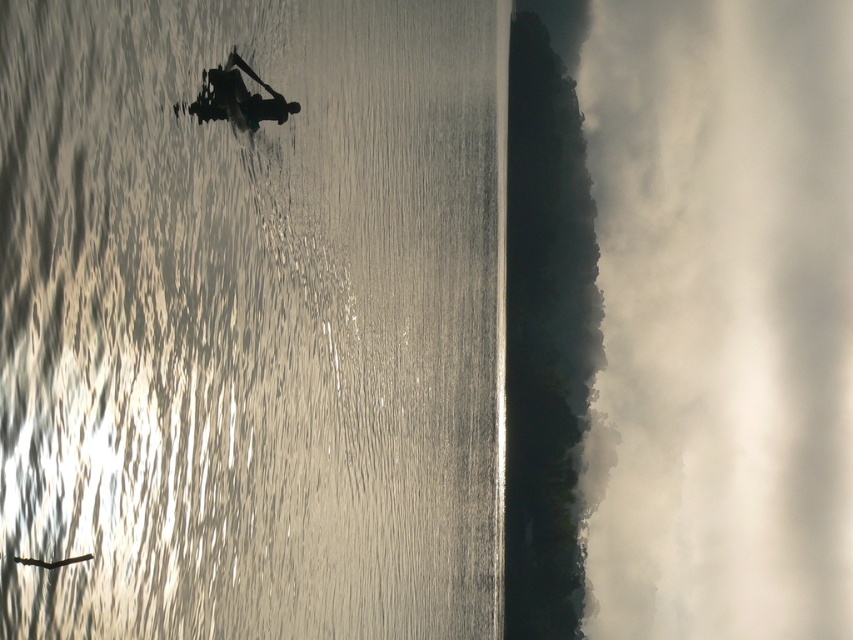
You are a GUI agent. You are given a task and a screenshot of the screen. Output one action in this format:
    pyautogui.click(x=<x>, y=<y>)
    Task: Click on the reflective silver water at center
    Image resolution: width=853 pixels, height=640 pixels.
    Given the screenshot: What is the action you would take?
    pyautogui.click(x=248, y=323)